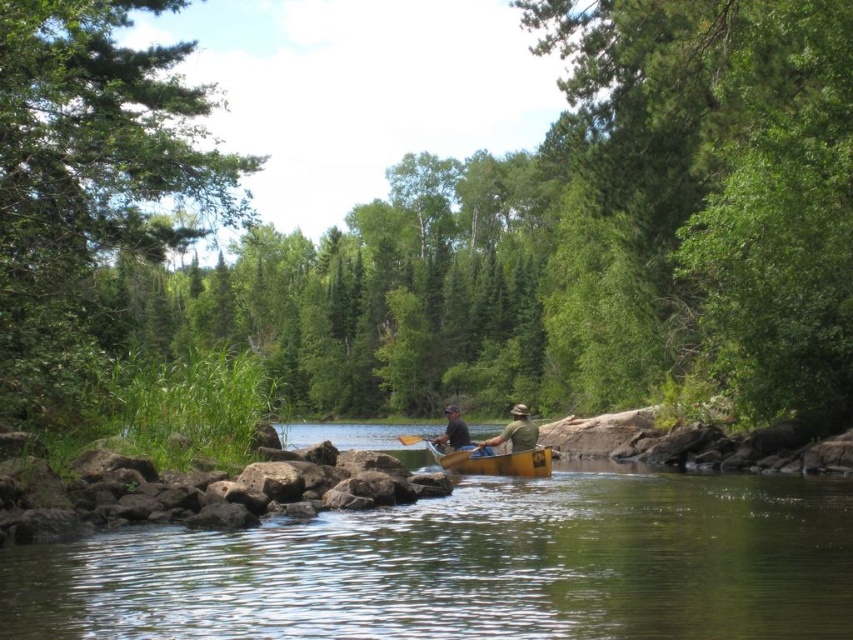
Does yellow wood canoe at center appear on the left side of wooden paddle at center?

Incorrect, yellow wood canoe at center is not on the left side of wooden paddle at center.

Is point (523, 472) closer to viewer compared to point (434, 444)?

Yes, point (523, 472) is closer to viewer.

You are a GUI agent. You are given a task and a screenshot of the screen. Output one action in this format:
    pyautogui.click(x=<x>, y=<y>)
    Task: Click on the yellow wood canoe at center
    This screenshot has width=853, height=640.
    Given the screenshot: What is the action you would take?
    pyautogui.click(x=497, y=461)

Does green leafy tree at left appear over wooden paddle at center?

Correct, green leafy tree at left is located above wooden paddle at center.

Can you confirm if green leafy tree at left is positioned below wooden paddle at center?

Actually, green leafy tree at left is above wooden paddle at center.

Who is more distant from viewer, (51,372) or (404,440)?

The point (404,440) is more distant.

Where is `green leafy tree at left`? green leafy tree at left is located at coordinates (88, 184).

Between green leafy tree at left and green fabric hat at center, which one has more height?

green leafy tree at left

Which of these two, green leafy tree at left or green fabric hat at center, stands shorter?

green fabric hat at center

Describe the element at coordinates (88, 184) in the screenshot. I see `green leafy tree at left` at that location.

Locate an element on the screen. This screenshot has width=853, height=640. green leafy tree at left is located at coordinates (88, 184).